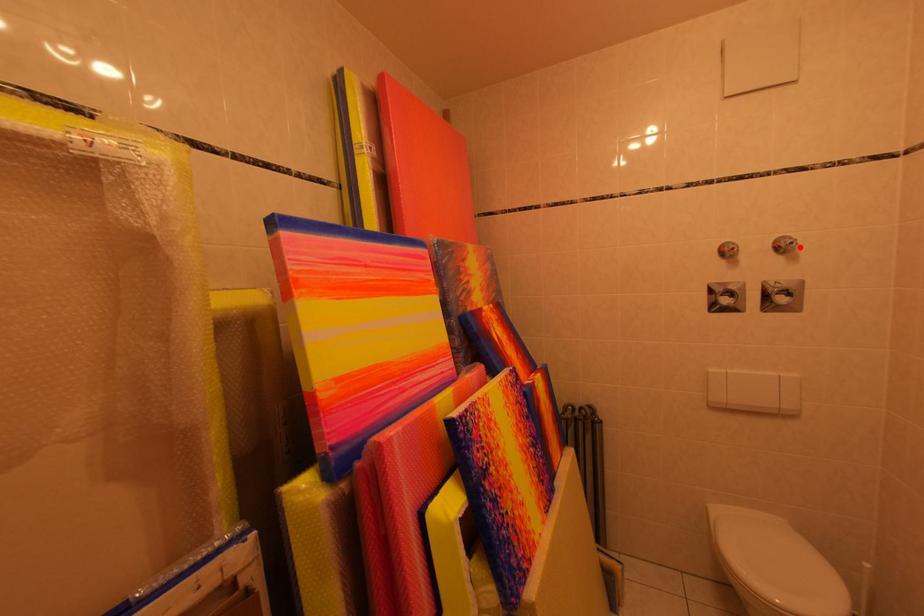
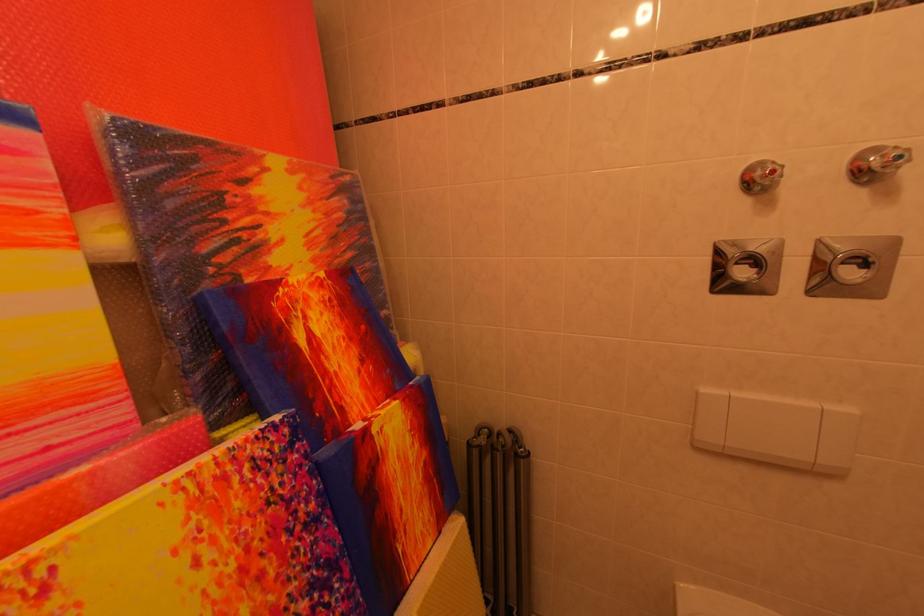
Find the pixel in the second image that matches the highlighted location in the first image.

(907, 161)